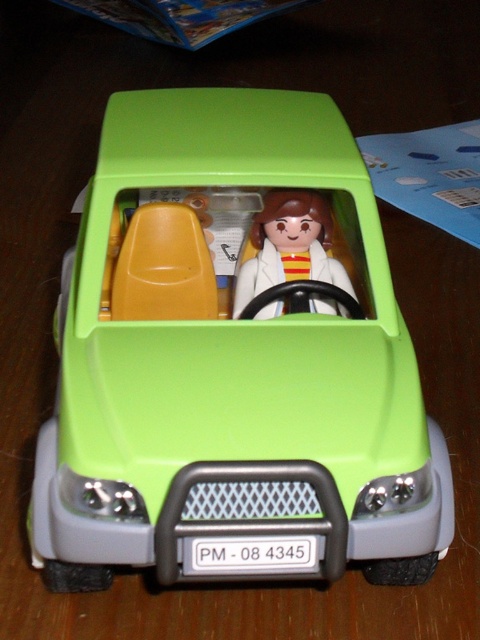
Question: Is lime matte toy car at center bigger than matte plastic figure at center?

Choices:
 (A) yes
 (B) no

Answer: (A)

Question: Is the position of lime matte toy car at center more distant than that of matte plastic figure at center?

Choices:
 (A) yes
 (B) no

Answer: (B)

Question: Does lime matte toy car at center come behind matte plastic figure at center?

Choices:
 (A) no
 (B) yes

Answer: (A)